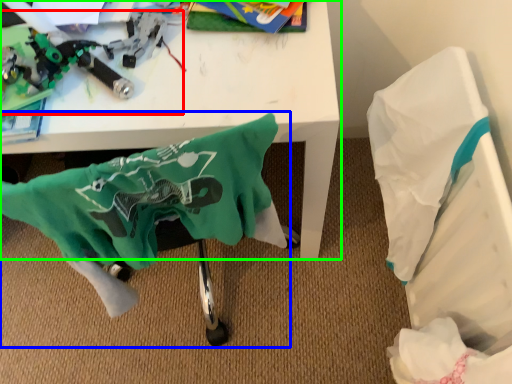
Question: Which object is positioned closest to toy (highlighted by a red box)? Select from swivel chair (highlighted by a blue box) and table (highlighted by a green box).

Choices:
 (A) swivel chair
 (B) table

Answer: (B)